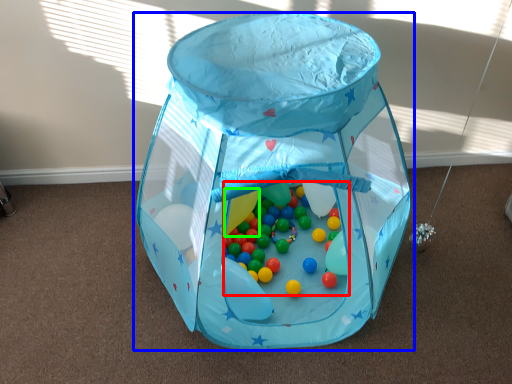
Question: Based on their relative distances, which object is nearer to toy (highlighted by a red box)? Choose from toy (highlighted by a blue box) and balloon (highlighted by a green box).

Choices:
 (A) toy
 (B) balloon

Answer: (B)